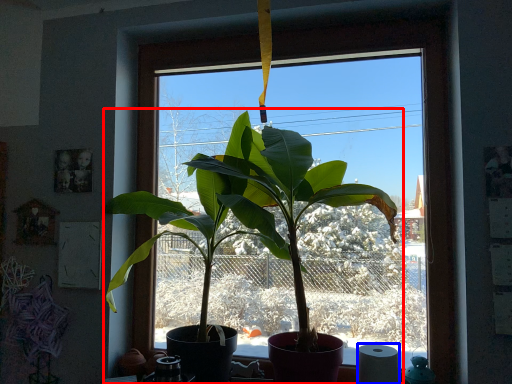
Question: Which object is closer to the camera taking this photo, houseplant (highlighted by a red box) or toilet paper (highlighted by a blue box)?

Choices:
 (A) houseplant
 (B) toilet paper

Answer: (A)